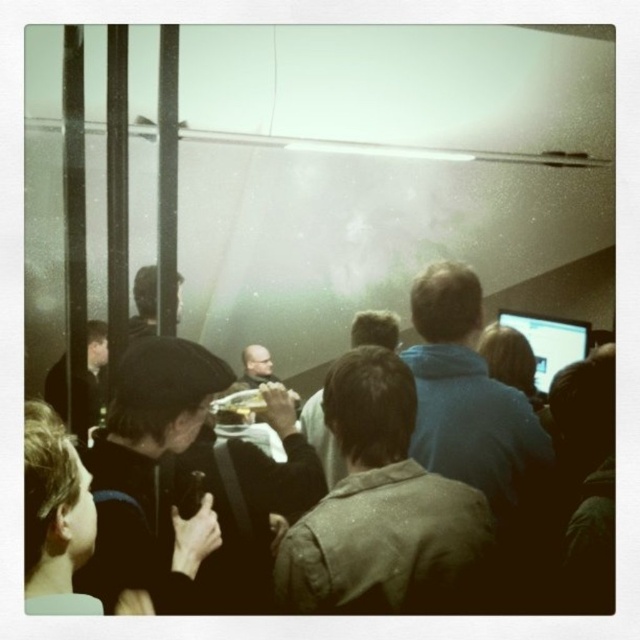
Question: Can you confirm if dark brown leather jacket at center is wider than dark brown leather jacket at left?

Choices:
 (A) yes
 (B) no

Answer: (A)

Question: Does dark woolen hat at center appear on the right side of blue fleece jacket at center?

Choices:
 (A) yes
 (B) no

Answer: (B)

Question: Which point appears farthest from the camera in this image?

Choices:
 (A) (380, 342)
 (B) (435, 298)
 (C) (93, 362)

Answer: (A)

Question: Which object is closer to the camera taking this photo?

Choices:
 (A) matte black jacket at center
 (B) dark brown leather jacket at center

Answer: (B)

Question: Which of the following is the farthest from the observer?

Choices:
 (A) dark woolen hat at center
 (B) dark brown leather jacket at center

Answer: (B)

Question: Is brown textured jacket at center thinner than matte black monitor at upper right?

Choices:
 (A) yes
 (B) no

Answer: (B)